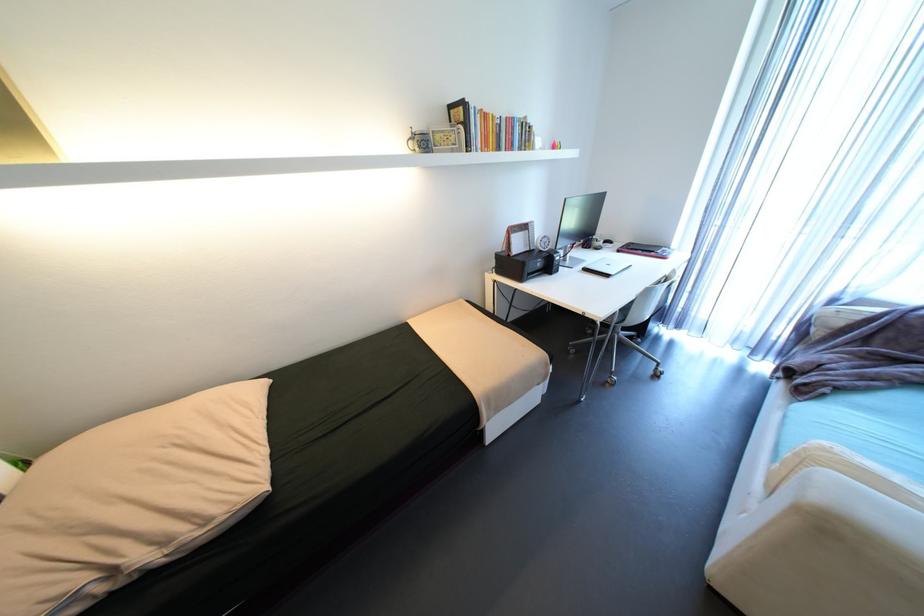
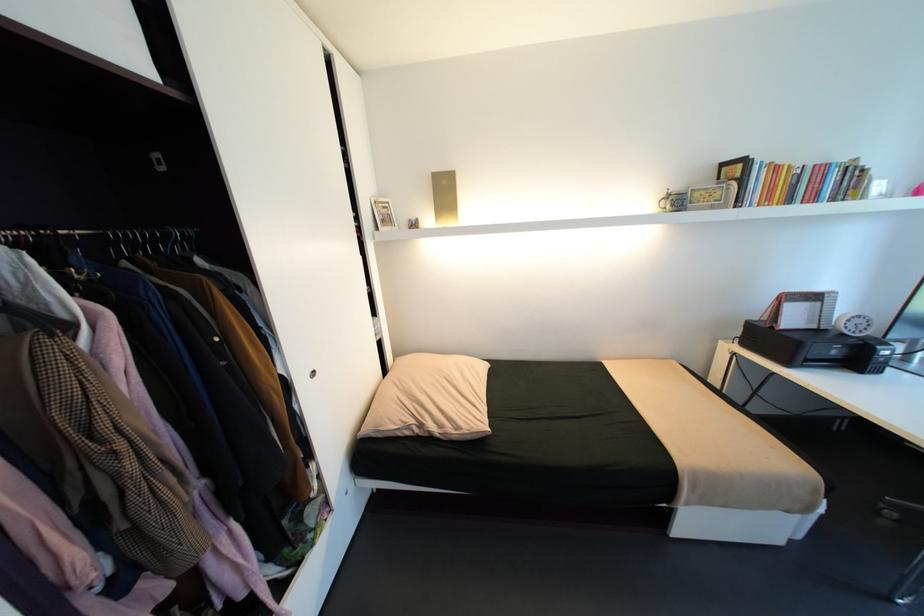
The point at (420, 131) is marked in the first image. Where is the corresponding point in the second image?

(676, 192)